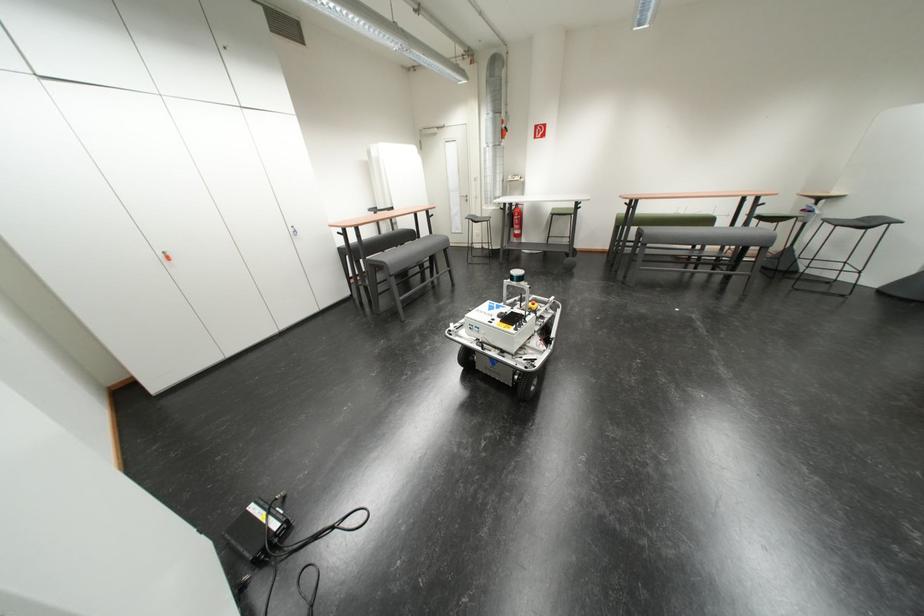
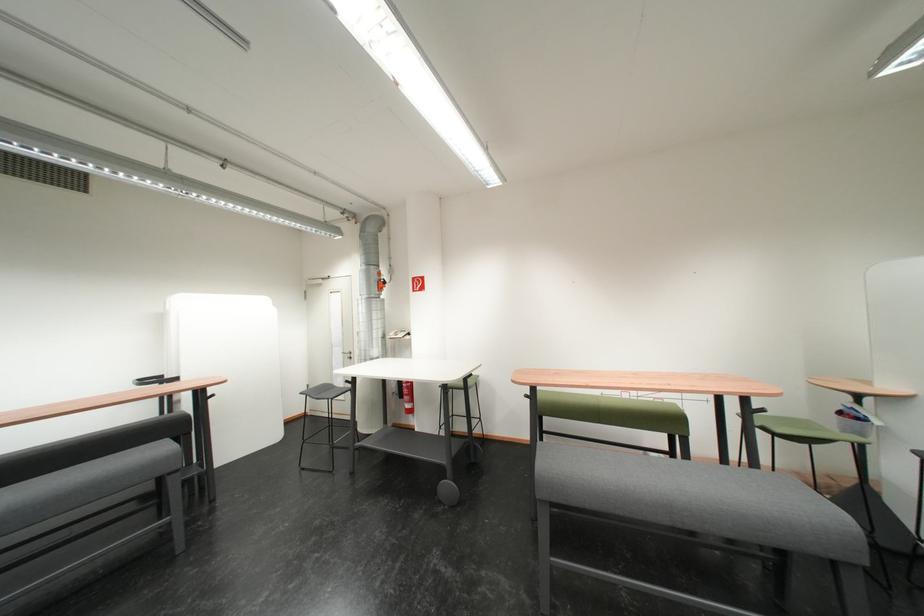
What movement of the cameraman would produce the second image?

The movement direction of the cameraman is right, forward.